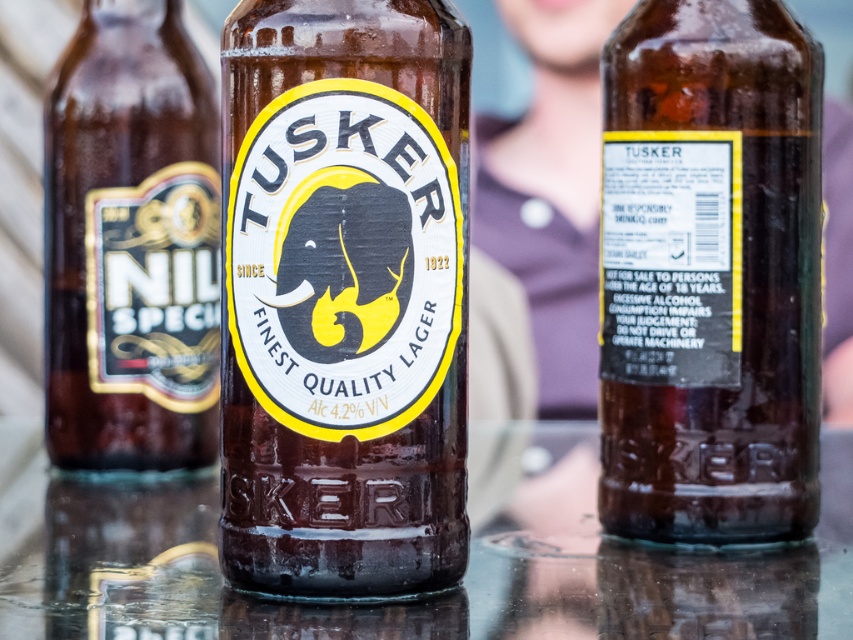
The width and height of the screenshot is (853, 640). Describe the element at coordinates (344, 298) in the screenshot. I see `matte glass tusker lager at center` at that location.

Which is more to the right, matte glass tusker lager at center or matte gold label at left?

matte glass tusker lager at center

Locate an element on the screen. matte glass tusker lager at center is located at coordinates (344, 298).

Is point (672, 198) closer to camera compared to point (128, 305)?

That is True.

Is brown glass bottle at center thinner than matte gold label at left?

In fact, brown glass bottle at center might be wider than matte gold label at left.

Between point (799, 346) and point (115, 51), which one is positioned in front?

Point (799, 346) is more forward.

Where is `brown glass bottle at center`? brown glass bottle at center is located at coordinates (711, 273).

Is matte glass tusker lager at center wider than brown glass bottle at center?

No, matte glass tusker lager at center is not wider than brown glass bottle at center.

Can you confirm if matte glass tusker lager at center is taller than brown glass bottle at center?

In fact, matte glass tusker lager at center may be shorter than brown glass bottle at center.

Is point (386, 376) closer to camera compared to point (619, 339)?

Yes, point (386, 376) is closer to viewer.

At what (x,y) coordinates should I click in order to perform the action: click on matte glass tusker lager at center. Please return your answer as a coordinate pair (x, y). Looking at the image, I should click on (344, 298).